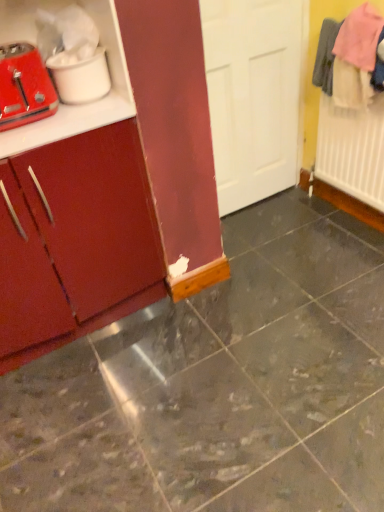
The width and height of the screenshot is (384, 512). Describe the element at coordinates (219, 385) in the screenshot. I see `marble tile floor at center` at that location.

Find the location of a particular element. matte wood cabinet at left is located at coordinates (75, 241).

In the scene shown: Is matte wood cabinet at left looking in the opposite direction of marble tile floor at center?

matte wood cabinet at left is not turned away from marble tile floor at center.

Which is in front, point (1, 303) or point (302, 258)?

The point (1, 303) is more forward.

Which object is further away from the camera, matte wood cabinet at left or marble tile floor at center?

matte wood cabinet at left is more distant.

Considering the sizes of matte wood cabinet at left and marble tile floor at center in the image, is matte wood cabinet at left bigger or smaller than marble tile floor at center?

Clearly, matte wood cabinet at left is larger in size than marble tile floor at center.

Is marble tile floor at center taller or shorter than matte wood cabinet at left?

In the image, marble tile floor at center appears to be shorter than matte wood cabinet at left.

Considering the relative sizes of marble tile floor at center and matte wood cabinet at left in the image provided, is marble tile floor at center wider than matte wood cabinet at left?

Yes.

Which object is further away from the camera taking this photo, marble tile floor at center or matte wood cabinet at left?

matte wood cabinet at left is further away from the camera.

In order to click on cabinetry that is above the marble tile floor at center (from the image's perspective) in this screenshot , I will do `click(75, 241)`.

Find the location of a particular element. The width and height of the screenshot is (384, 512). cabinetry that appears in front of the matte red toaster at left is located at coordinates (75, 241).

Can you confirm if matte red toaster at left is taller than matte wood cabinet at left?

Incorrect, the height of matte red toaster at left is not larger of that of matte wood cabinet at left.

Is matte red toaster at left turned away from matte wood cabinet at left?

matte red toaster at left does not have its back to matte wood cabinet at left.

Between matte red toaster at left and matte wood cabinet at left, which one is positioned behind?

matte red toaster at left is more distant.

Does matte wood cabinet at left touch matte red toaster at left?

No, matte wood cabinet at left is not with matte red toaster at left.

Is matte wood cabinet at left at the left side of matte red toaster at left?

No.

Based on their sizes in the image, would you say matte wood cabinet at left is bigger or smaller than matte red toaster at left?

matte wood cabinet at left is bigger than matte red toaster at left.

From the image's perspective, between marble tile floor at center and matte red toaster at left, who is located below?

From the image's view, marble tile floor at center is below.

Between marble tile floor at center and matte red toaster at left, which one has smaller size?

Smaller between the two is matte red toaster at left.

Does point (265, 508) come in front of point (28, 92)?

Yes.

The image size is (384, 512). Identify the location of concrete lying on the right of matte red toaster at left. (219, 385).

From the image's perspective, which is above, matte white toaster at left or matte wood cabinet at left?

matte white toaster at left.

Considering the sizes of matte white toaster at left and matte wood cabinet at left in the image, is matte white toaster at left bigger or smaller than matte wood cabinet at left?

Considering their sizes, matte white toaster at left takes up less space than matte wood cabinet at left.

Is matte white toaster at left spatially inside matte wood cabinet at left, or outside of it?

The correct answer is: outside.

Would you say matte wood cabinet at left is outside matte white toaster at left?

Yes, matte wood cabinet at left is located beyond the bounds of matte white toaster at left.

Does point (29, 236) lie in front of point (87, 95)?

No.

Is matte wood cabinet at left not near matte white toaster at left?

No, matte wood cabinet at left is not far from matte white toaster at left.

Identify the location of cabinetry below the matte white toaster at left (from a real-world perspective). (75, 241).

Identify the location of cabinetry located on the left of marble tile floor at center. (75, 241).

I want to click on concrete in front of the matte wood cabinet at left, so click(219, 385).

Looking at the image, which one is located closer to matte wood cabinet at left, matte white toaster at left or matte red toaster at left?

matte red toaster at left is closer to matte wood cabinet at left.

Considering their positions, is matte wood cabinet at left positioned further to marble tile floor at center than matte white toaster at left?

Based on the image, matte white toaster at left appears to be further to marble tile floor at center.

Consider the image. Based on their spatial positions, is matte wood cabinet at left or marble tile floor at center further from matte white toaster at left?

Among the two, marble tile floor at center is located further to matte white toaster at left.

When comparing their distances from marble tile floor at center, does matte white toaster at left or matte wood cabinet at left seem further?

matte white toaster at left is further to marble tile floor at center.

Looking at the image, which one is located closer to matte white toaster at left, marble tile floor at center or matte wood cabinet at left?

matte wood cabinet at left is positioned closer to the anchor matte white toaster at left.

Looking at the image, which one is located closer to matte wood cabinet at left, marble tile floor at center or matte white toaster at left?

matte white toaster at left.

From the image, which object appears to be farther from matte wood cabinet at left, matte red toaster at left or marble tile floor at center?

marble tile floor at center is positioned further to the anchor matte wood cabinet at left.

From the picture: From the image, which object appears to be nearer to matte wood cabinet at left, matte red toaster at left or matte white toaster at left?

The object closer to matte wood cabinet at left is matte red toaster at left.

Locate an element on the screen. Image resolution: width=384 pixels, height=512 pixels. toaster that lies between matte white toaster at left and matte wood cabinet at left from top to bottom is located at coordinates (24, 87).

Identify the location of cabinetry that lies between matte white toaster at left and marble tile floor at center from top to bottom. (75, 241).

The height and width of the screenshot is (512, 384). What are the coordinates of `toaster between matte white toaster at left and marble tile floor at center from top to bottom` in the screenshot? It's located at (24, 87).

Find the location of a particular element. cabinetry between matte red toaster at left and marble tile floor at center from top to bottom is located at coordinates (75, 241).